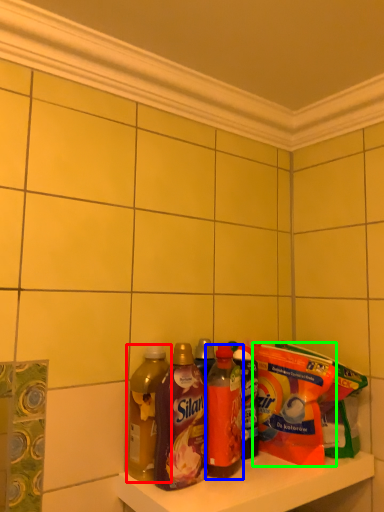
Question: Estimate the real-world distances between objects in this image. Which object is farther from bottle (highlighted by a red box), bottle (highlighted by a blue box) or cereal (highlighted by a green box)?

Choices:
 (A) bottle
 (B) cereal

Answer: (B)